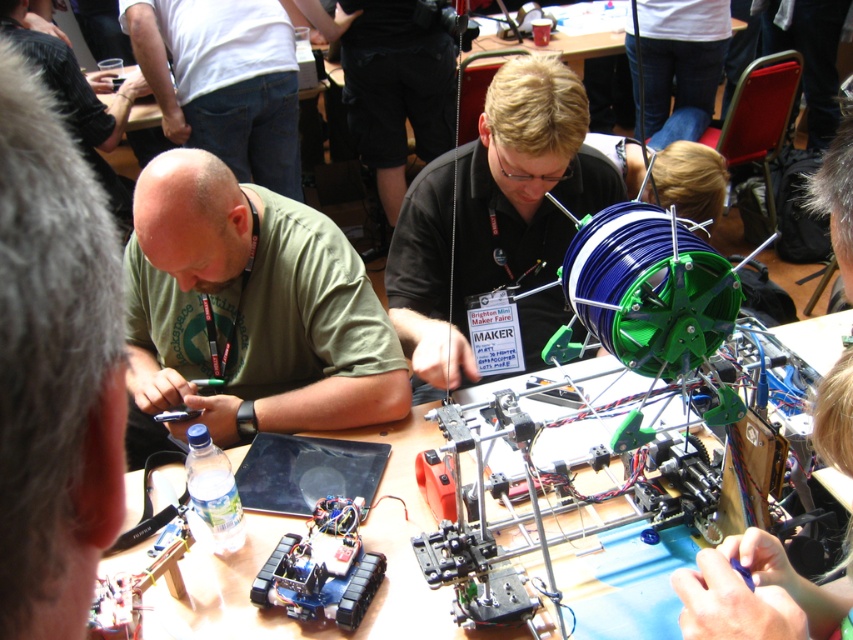
Question: Which object is closer to the camera taking this photo?

Choices:
 (A) green matte spool at center
 (B) wooden table at center
 (C) green matte shirt at center

Answer: (B)

Question: Can you confirm if green matte spool at center is wider than wooden table at center?

Choices:
 (A) no
 (B) yes

Answer: (A)

Question: Can you confirm if green matte spool at center is thinner than wooden table at center?

Choices:
 (A) no
 (B) yes

Answer: (B)

Question: Which of the following is the farthest from the observer?

Choices:
 (A) (509, 243)
 (B) (289, 218)

Answer: (A)

Question: Which point is closer to the camera?

Choices:
 (A) green matte shirt at center
 (B) green matte spool at center

Answer: (A)

Question: Does green matte shirt at center appear over wooden table at center?

Choices:
 (A) yes
 (B) no

Answer: (A)